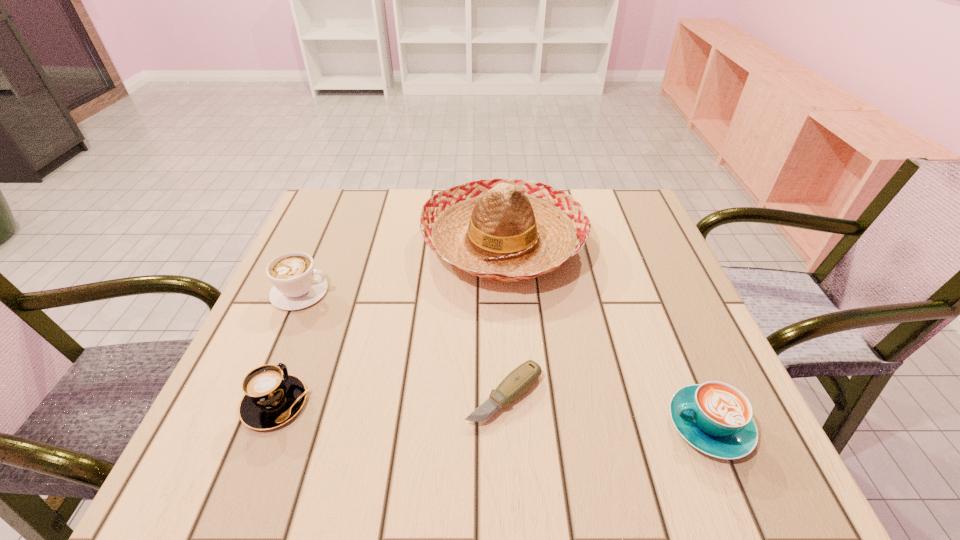
Find the location of a particular element. The image size is (960, 540). free space that is in between the farthest cappuccino and the pocketknife is located at coordinates (402, 343).

This screenshot has height=540, width=960. Find the location of `unoccupied position between the rightmost object and the pocketknife`. unoccupied position between the rightmost object and the pocketknife is located at coordinates (607, 410).

Find the location of `free spot between the farthest cappuccino and the tallest object`. free spot between the farthest cappuccino and the tallest object is located at coordinates (402, 267).

This screenshot has width=960, height=540. I want to click on vacant region between the farthest cappuccino and the shortest object, so click(402, 343).

Identify the location of free spot between the pocketknife and the rightmost object. This screenshot has width=960, height=540. (607, 410).

Identify the location of object identified as the fourth closest to the rightmost cappuccino. This screenshot has height=540, width=960. (297, 284).

Identify which object is the second closest to the tallest object. Please provide its 2D coordinates. Your answer should be formatted as a tuple, i.e. [(x, y)], where the tuple contains the x and y coordinates of a point satisfying the conditions above.

[(297, 284)]

Where is `cappuccino that can be found as the closest to the pocketknife`? The width and height of the screenshot is (960, 540). cappuccino that can be found as the closest to the pocketknife is located at coordinates (716, 418).

Locate which cappuccino ranks second in proximity to the farthest cappuccino. Please provide its 2D coordinates. Your answer should be formatted as a tuple, i.e. [(x, y)], where the tuple contains the x and y coordinates of a point satisfying the conditions above.

[(716, 418)]

This screenshot has width=960, height=540. I want to click on free space in the image that satisfies the following two spatial constraints: 1. to the right of the pocketknife's handle; 2. on the right side of the farthest cappuccino, so click(256, 395).